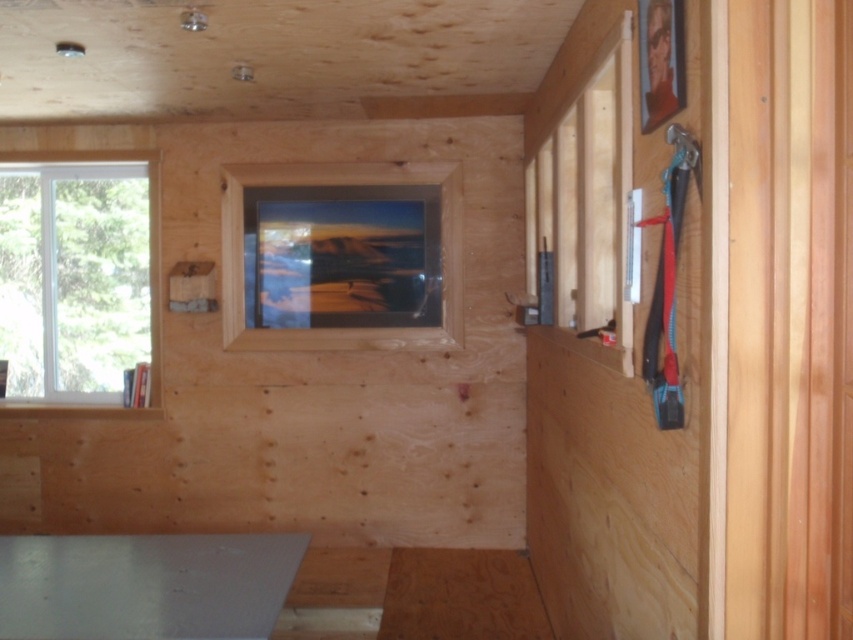
Question: Is white glossy table at lower left further to camera compared to matte wooden frame at center?

Choices:
 (A) yes
 (B) no

Answer: (B)

Question: Is white plastic window at left thinner than matte wooden frame at center?

Choices:
 (A) yes
 (B) no

Answer: (A)

Question: Can you confirm if white plastic window at left is wider than matte wooden frame at center?

Choices:
 (A) yes
 (B) no

Answer: (B)

Question: Based on their relative distances, which object is farther from the white glossy table at lower left?

Choices:
 (A) matte wooden frame at center
 (B) white plastic window at left

Answer: (B)

Question: Which point appears farthest from the camera in this image?

Choices:
 (A) (180, 602)
 (B) (96, 349)
 (C) (230, 250)

Answer: (B)

Question: Considering the real-world distances, which object is farthest from the white glossy table at lower left?

Choices:
 (A) white plastic window at left
 (B) matte wooden frame at center

Answer: (A)